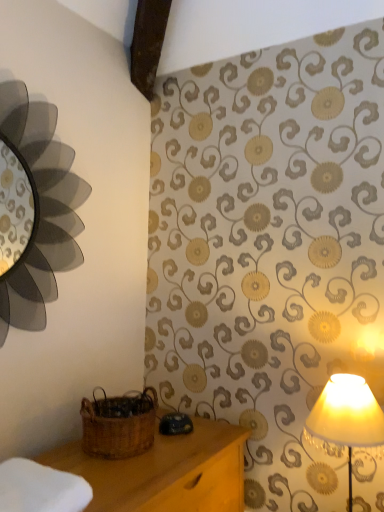
Question: From a real-world perspective, is matte cream lampshade at right over white soft cloth at lower left?

Choices:
 (A) yes
 (B) no

Answer: (A)

Question: Can you confirm if matte cream lampshade at right is thinner than white soft cloth at lower left?

Choices:
 (A) yes
 (B) no

Answer: (A)

Question: Considering the relative sizes of matte cream lampshade at right and white soft cloth at lower left in the image provided, is matte cream lampshade at right shorter than white soft cloth at lower left?

Choices:
 (A) yes
 (B) no

Answer: (B)

Question: From the image's perspective, is matte cream lampshade at right over white soft cloth at lower left?

Choices:
 (A) yes
 (B) no

Answer: (B)

Question: Would you consider matte cream lampshade at right to be distant from white soft cloth at lower left?

Choices:
 (A) no
 (B) yes

Answer: (A)

Question: Considering the relative sizes of matte cream lampshade at right and white soft cloth at lower left in the image provided, is matte cream lampshade at right wider than white soft cloth at lower left?

Choices:
 (A) yes
 (B) no

Answer: (B)

Question: From the image's perspective, is woven brown basket at lower left below matte cream lampshade at right?

Choices:
 (A) no
 (B) yes

Answer: (A)

Question: Does woven brown basket at lower left have a lesser height compared to matte cream lampshade at right?

Choices:
 (A) no
 (B) yes

Answer: (B)

Question: From a real-world perspective, is woven brown basket at lower left located higher than matte cream lampshade at right?

Choices:
 (A) no
 (B) yes

Answer: (B)

Question: Is woven brown basket at lower left surrounding matte cream lampshade at right?

Choices:
 (A) yes
 (B) no

Answer: (B)

Question: Can you confirm if woven brown basket at lower left is smaller than matte cream lampshade at right?

Choices:
 (A) yes
 (B) no

Answer: (A)

Question: Is woven brown basket at lower left further to the viewer compared to matte cream lampshade at right?

Choices:
 (A) no
 (B) yes

Answer: (B)

Question: Does matte cream lampshade at right have a greater width compared to woven brown basket at lower left?

Choices:
 (A) no
 (B) yes

Answer: (A)